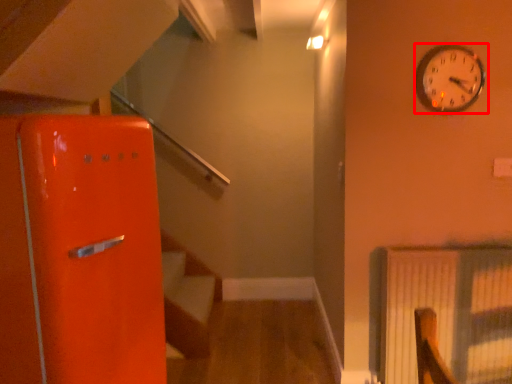
Question: From the image's perspective, what is the correct spatial relationship of wall clock (annotated by the red box) in relation to radiator?

Choices:
 (A) below
 (B) above

Answer: (B)